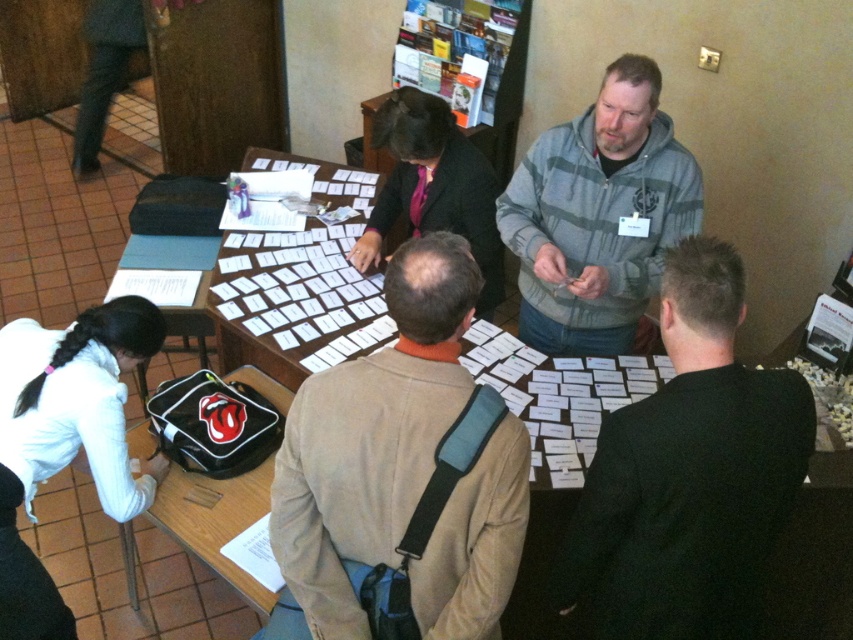
You are trying to locate the beige sweater at center in the image. According to the coordinates provided, where exactly is it positioned?

The beige sweater at center is positioned at the coordinates point (401,467).

You are organizing a seating arrangement for an event and need to place two items on a table. The beige sweater at center and the dark gray hoodie at center are both on the table. According to the scene, which item is closer to the bottom edge of the table?

The beige sweater at center is positioned under the dark gray hoodie at center, so the beige sweater at center is closer to the bottom edge of the table.

You are organizing a small event and need to place a 1.2 meter wide banner between the gray striped hoodie at upper right and the white fabric at lower left. Based on their widths, will the banner fit between them?

The gray striped hoodie at upper right is wider than the white fabric at lower left. However, the banner requires 1.2 meters of space, so it depends on the actual distance between them, not just their widths. The provided information about their widths doesn